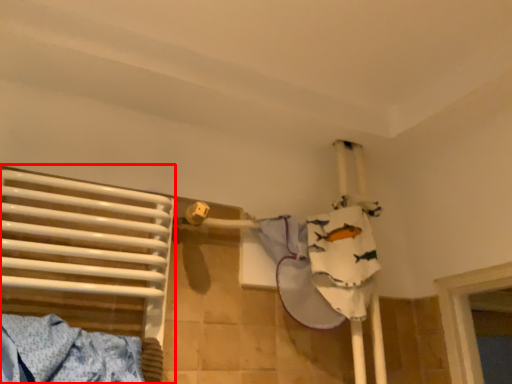
Question: In this image, where is bed (annotated by the red box) located relative to clothing?

Choices:
 (A) left
 (B) right

Answer: (A)